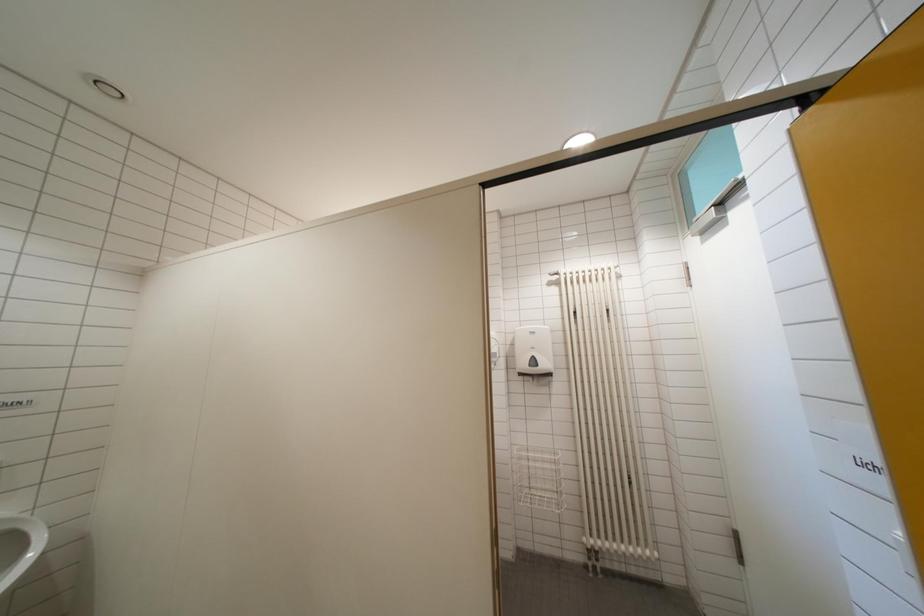
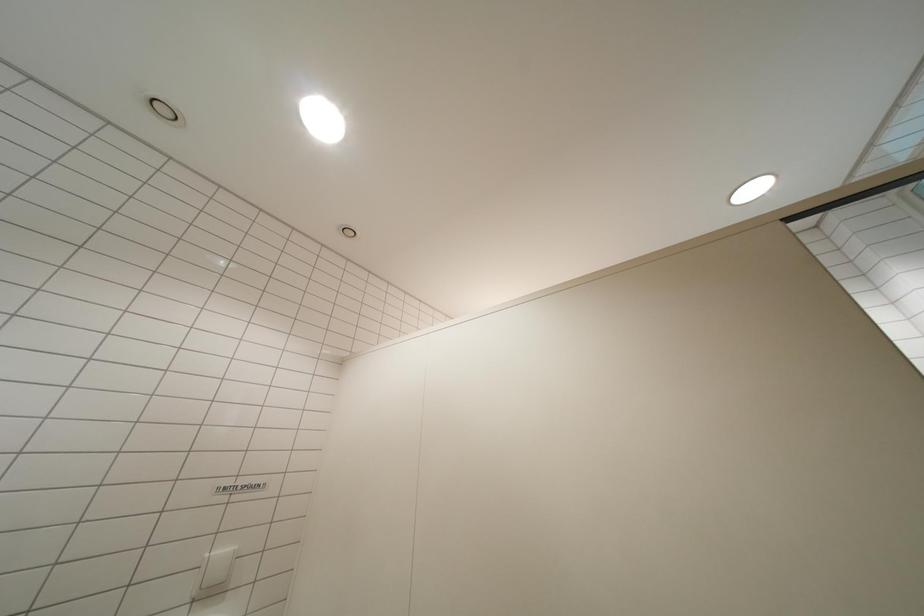
The images are taken continuously from a first-person perspective. In which direction is your viewpoint rotating?

The camera's rotation is toward left-up.